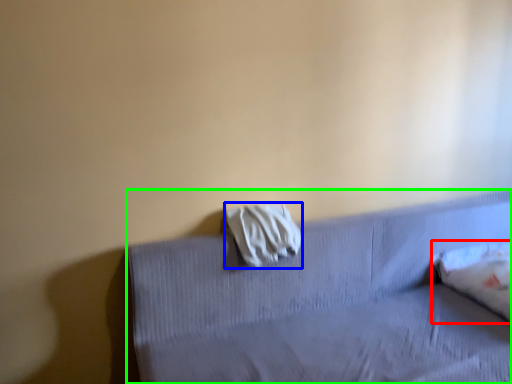
Question: Based on their relative distances, which object is farther from pillow (highlighted by a red box)? Choose from material (highlighted by a blue box) and furniture (highlighted by a green box).

Choices:
 (A) material
 (B) furniture

Answer: (A)